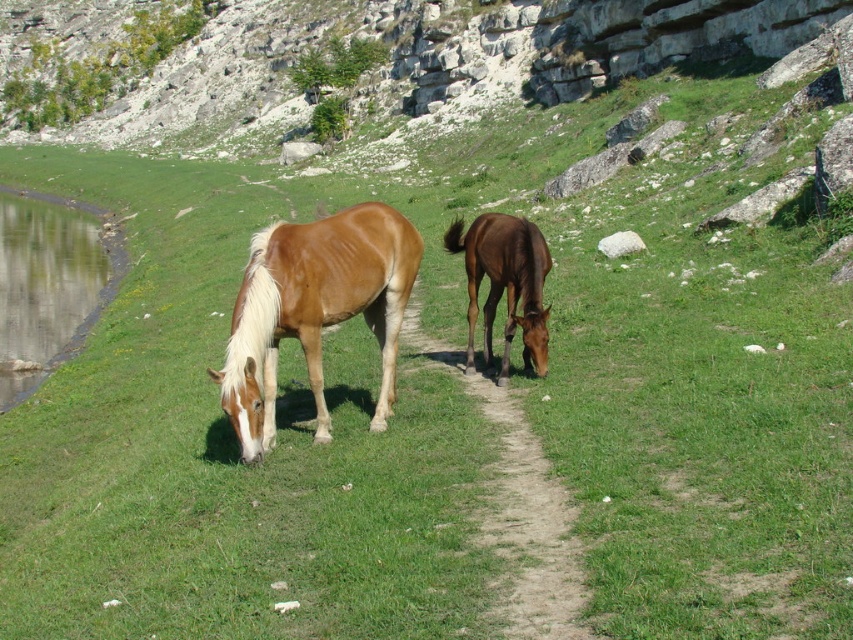
Which is behind, point (3, 200) or point (486, 369)?

Positioned behind is point (3, 200).

Is green grassy water at left to the left of brown glossy horse at center from the viewer's perspective?

Indeed, green grassy water at left is positioned on the left side of brown glossy horse at center.

Identify the location of green grassy water at left. (50, 284).

Identify the location of green grassy water at left. (50, 284).

Is dirt path at center above green grassy water at left?

Actually, dirt path at center is below green grassy water at left.

Is dirt path at center below green grassy water at left?

Correct, dirt path at center is located below green grassy water at left.

Is point (547, 534) closer to camera compared to point (51, 200)?

Yes, point (547, 534) is in front of point (51, 200).

Where is `dirt path at center`? The image size is (853, 640). dirt path at center is located at coordinates (517, 508).

Measure the distance between light brown glossy horse at left and camera.

light brown glossy horse at left is 8.71 meters away from camera.

Does point (334, 276) lie behind point (495, 492)?

Yes, it is behind point (495, 492).

Identify the location of light brown glossy horse at left. (314, 310).